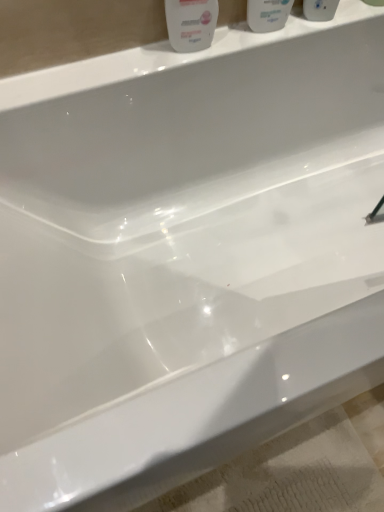
This screenshot has height=512, width=384. Identify the location of blank space to the left of white glossy bottle at upper center. (113, 68).